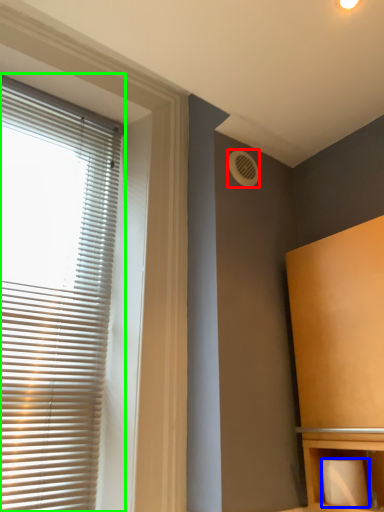
Question: Which object is positioned farthest from air conditioning (highlighted by a red box)? Select from toilet paper (highlighted by a blue box) and window blind (highlighted by a green box).

Choices:
 (A) toilet paper
 (B) window blind

Answer: (A)